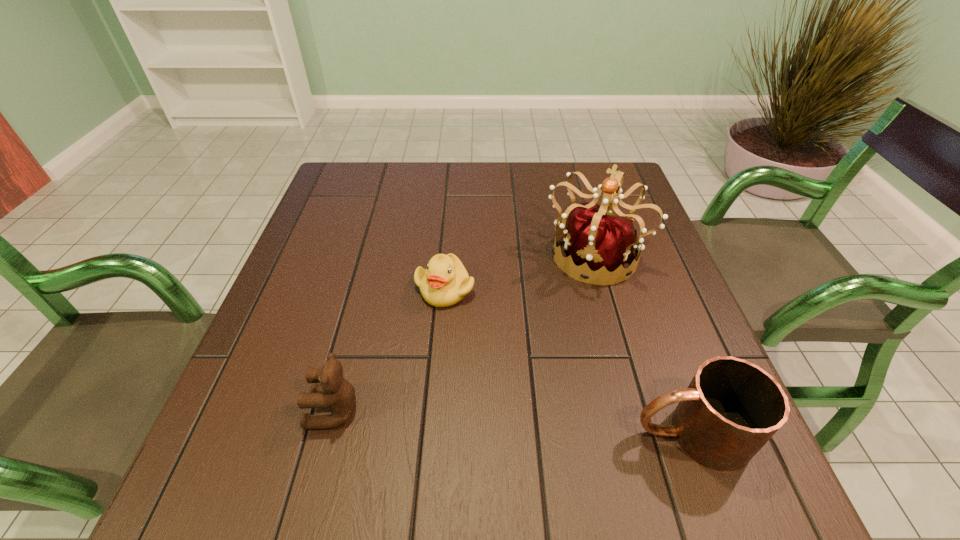
Find the location of a particular element. The image size is (960, 540). free space between the shortest object and the mug is located at coordinates (567, 361).

I want to click on vacant space that's between the tallest object and the teddy bear, so click(x=464, y=332).

You are a GUI agent. You are given a task and a screenshot of the screen. Output one action in this format:
    pyautogui.click(x=<x>, y=<y>)
    Task: Click on the vacant area that lies between the tallest object and the mug
    The height and width of the screenshot is (540, 960).
    Given the screenshot: What is the action you would take?
    pyautogui.click(x=642, y=344)

Identify the location of vacant space that is in between the shortest object and the leftmost object. The width and height of the screenshot is (960, 540). [x=389, y=349].

At what (x,y) coordinates should I click in order to perform the action: click on free space between the teddy bear and the shortest object. Please return your answer as a coordinate pair (x, y). Looking at the image, I should click on (389, 349).

The image size is (960, 540). Find the location of `vacant point located between the leftmost object and the shortest object`. vacant point located between the leftmost object and the shortest object is located at coordinates [389, 349].

At what (x,y) coordinates should I click in order to perform the action: click on free point between the teddy bear and the tiara. Please return your answer as a coordinate pair (x, y). This screenshot has width=960, height=540. Looking at the image, I should click on (464, 332).

The width and height of the screenshot is (960, 540). In order to click on empty location between the teddy bear and the mug in this screenshot , I will do `click(513, 422)`.

The height and width of the screenshot is (540, 960). I want to click on free spot between the tiara and the mug, so click(x=642, y=344).

Where is `empty location between the shortest object and the leftmost object`? This screenshot has height=540, width=960. empty location between the shortest object and the leftmost object is located at coordinates (389, 349).